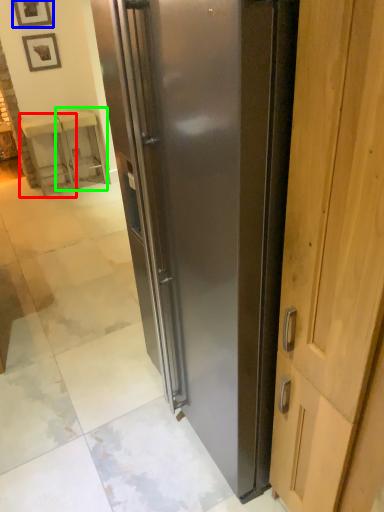
Question: Which object is the closest to the furniture (highlighted by a red box)? Choose among these: picture frame (highlighted by a blue box) or furniture (highlighted by a green box).

Choices:
 (A) picture frame
 (B) furniture

Answer: (B)